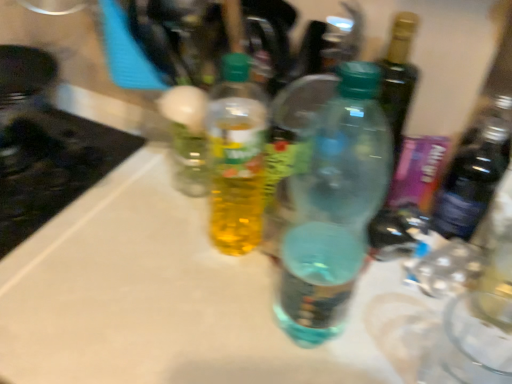
Image resolution: width=512 pixels, height=384 pixels. Identify the location of free location to the left of translucent plastic bottle at center, positioned as the first bottle in left-to-right order. [x=128, y=265].